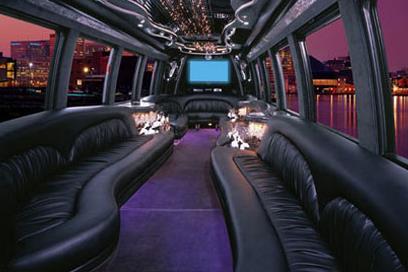
Locate an element on the screen. led is located at coordinates (203, 78).